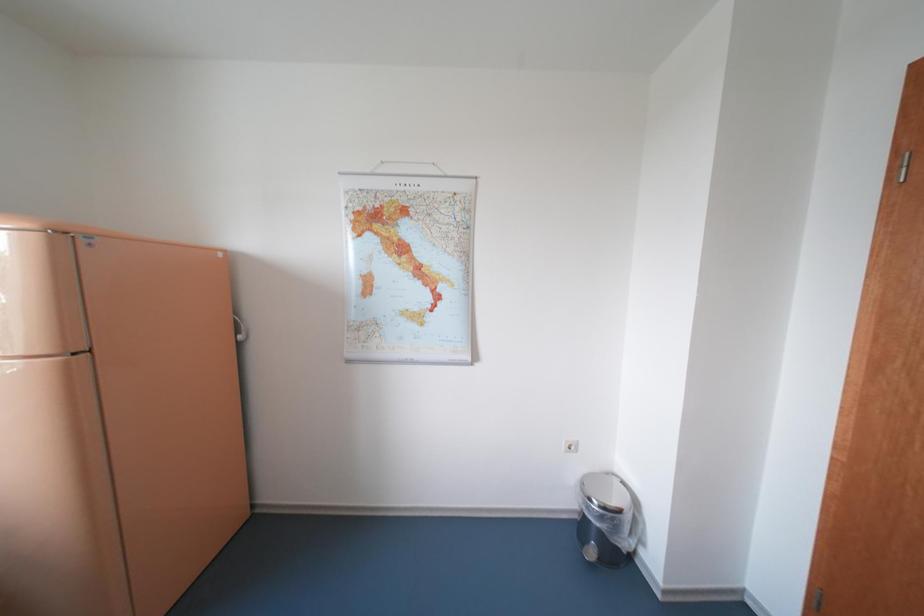
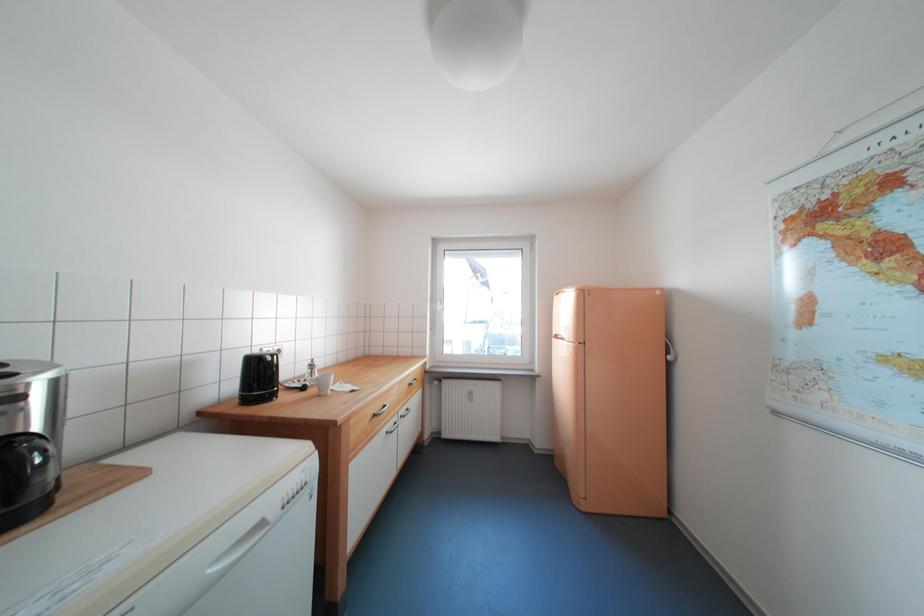
Question: The camera is either moving clockwise (left) or counter-clockwise (right) around the object. The first image is from the beginning of the video and the second image is from the end. Is the camera moving left or right when shooting the video?

Choices:
 (A) Left
 (B) Right

Answer: (B)